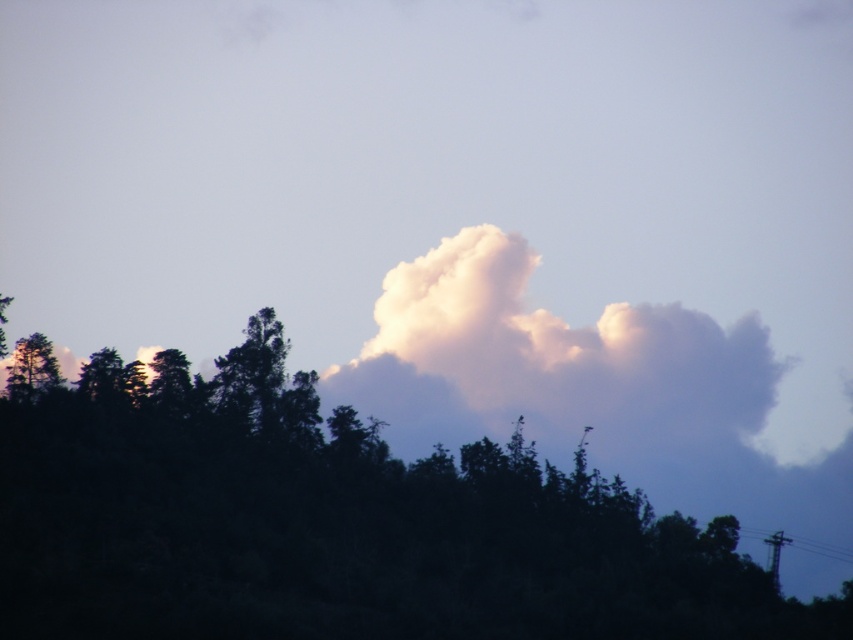
Question: Does dark green foliage at upper center have a lesser width compared to white fluffy cloud at upper center?

Choices:
 (A) no
 (B) yes

Answer: (A)

Question: Can you confirm if dark green foliage at upper center is wider than white fluffy cloud at upper center?

Choices:
 (A) yes
 (B) no

Answer: (A)

Question: Which point is closer to the camera?

Choices:
 (A) white fluffy cloud at upper center
 (B) dark green foliage at upper center

Answer: (B)

Question: Does dark green foliage at upper center appear on the right side of white fluffy cloud at upper center?

Choices:
 (A) no
 (B) yes

Answer: (A)

Question: Which point appears closest to the camera in this image?

Choices:
 (A) (454, 252)
 (B) (254, 595)

Answer: (B)

Question: Which of the following is the farthest from the observer?

Choices:
 (A) white fluffy cloud at upper center
 (B) dark green foliage at upper center

Answer: (A)